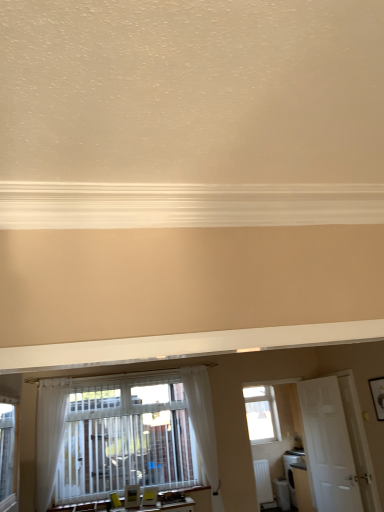
Question: Would you say white wooden door at right is a long distance from white sheer curtain at center, the second curtain in the left-to-right sequence?

Choices:
 (A) yes
 (B) no

Answer: (A)

Question: Are white wooden door at right and white sheer curtain at center, marked as the first curtain in a right-to-left arrangement, beside each other?

Choices:
 (A) no
 (B) yes

Answer: (A)

Question: From the image's perspective, would you say white wooden door at right is shown under white sheer curtain at center, marked as the first curtain in a right-to-left arrangement?

Choices:
 (A) yes
 (B) no

Answer: (A)

Question: Does white wooden door at right lie behind white sheer curtain at center, the second curtain in the left-to-right sequence?

Choices:
 (A) yes
 (B) no

Answer: (B)

Question: Can you confirm if white wooden door at right is positioned to the left of white sheer curtain at center, marked as the first curtain in a right-to-left arrangement?

Choices:
 (A) yes
 (B) no

Answer: (B)

Question: Can we say white wooden door at right lies outside white sheer curtain at center, the second curtain in the left-to-right sequence?

Choices:
 (A) yes
 (B) no

Answer: (A)

Question: Considering the relative sizes of white sheer curtain at center, marked as the first curtain in a right-to-left arrangement, and white matte radiator at lower right in the image provided, is white sheer curtain at center, marked as the first curtain in a right-to-left arrangement, bigger than white matte radiator at lower right?

Choices:
 (A) no
 (B) yes

Answer: (B)

Question: Would you say white sheer curtain at center, the second curtain in the left-to-right sequence, is outside white matte radiator at lower right?

Choices:
 (A) yes
 (B) no

Answer: (A)

Question: Is white sheer curtain at center, the second curtain in the left-to-right sequence, thinner than white matte radiator at lower right?

Choices:
 (A) yes
 (B) no

Answer: (B)

Question: From a real-world perspective, is white sheer curtain at center, the second curtain in the left-to-right sequence, located beneath white matte radiator at lower right?

Choices:
 (A) no
 (B) yes

Answer: (A)

Question: Considering the relative sizes of white sheer curtain at center, marked as the first curtain in a right-to-left arrangement, and white matte radiator at lower right in the image provided, is white sheer curtain at center, marked as the first curtain in a right-to-left arrangement, smaller than white matte radiator at lower right?

Choices:
 (A) no
 (B) yes

Answer: (A)

Question: Is white sheer curtain at center, marked as the first curtain in a right-to-left arrangement, positioned with its back to white matte radiator at lower right?

Choices:
 (A) no
 (B) yes

Answer: (A)

Question: Does clear glass window at center have a greater width compared to white sheer curtain at lower left, which is counted as the 2th curtain, starting from the right?

Choices:
 (A) yes
 (B) no

Answer: (B)